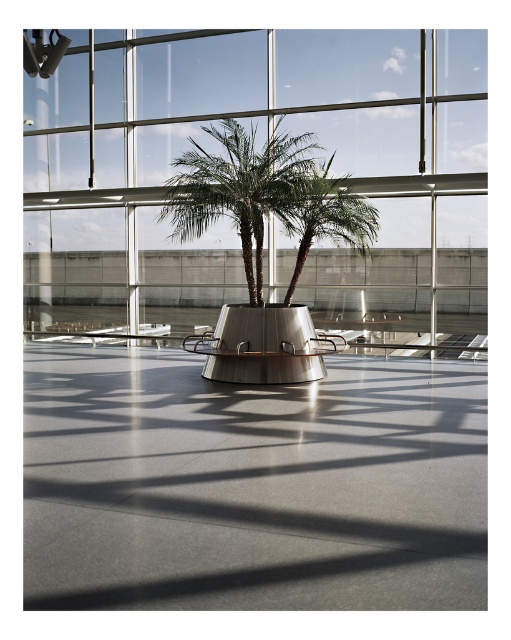
Based on the photo, can you confirm if transparent glass window at center is bigger than green glossy palm tree at center?

Yes.

Who is more forward, [453,184] or [289,291]?

Point [289,291] is more forward.

Where is `transparent glass window at center`? transparent glass window at center is located at coordinates (264, 138).

Who is higher up, green leafy palm tree at center or green glossy palm tree at center?

green leafy palm tree at center is above.

Is point (266, 196) positioned after point (290, 202)?

Yes, it is.

The height and width of the screenshot is (640, 511). Find the location of `green leafy palm tree at center`. green leafy palm tree at center is located at coordinates (238, 188).

Between transparent glass window at center and green leafy palm tree at center, which one appears on the right side from the viewer's perspective?

Positioned to the right is green leafy palm tree at center.

Who is shorter, transparent glass window at center or green leafy palm tree at center?

green leafy palm tree at center is shorter.

Is point (96, 307) farther from camera compared to point (226, 198)?

Yes.

You are a GUI agent. You are given a task and a screenshot of the screen. Output one action in this format:
    pyautogui.click(x=<x>, y=<y>)
    Task: Click on the transparent glass window at center
    The image size is (511, 640).
    Given the screenshot: What is the action you would take?
    pyautogui.click(x=264, y=138)